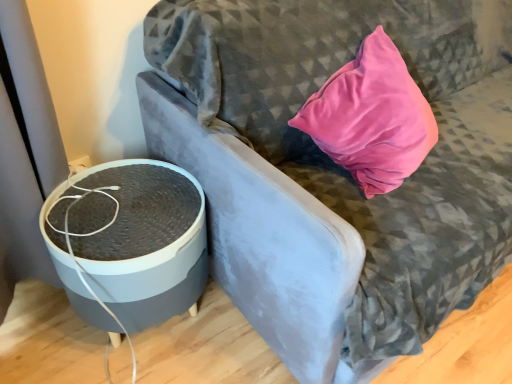
This screenshot has width=512, height=384. Describe the element at coordinates (146, 244) in the screenshot. I see `matte gray round table at left` at that location.

Identify the location of matte gray round table at left. (146, 244).

This screenshot has height=384, width=512. Describe the element at coordinates (341, 167) in the screenshot. I see `matte gray speaker at left` at that location.

Measure the distance between matte gray speaker at left and camera.

matte gray speaker at left and camera are 29.60 inches apart.

Identify the location of matte gray speaker at left. (341, 167).

Locate an element on the screen. This screenshot has width=512, height=384. matte gray round table at left is located at coordinates click(146, 244).

Is matte gray speaker at left to the right of matte gray round table at left from the viewer's perspective?

Yes.

Does matte gray speaker at left lie in front of matte gray round table at left?

Yes, it is.

Which is closer to the camera, (251, 87) or (154, 174)?

Point (251, 87) is positioned closer to the camera compared to point (154, 174).

From the image's perspective, which is below, matte gray speaker at left or matte gray round table at left?

matte gray round table at left, from the image's perspective.

From a real-world perspective, is matte gray speaker at left positioned over matte gray round table at left based on gravity?

Yes.

Is matte gray speaker at left wider than matte gray round table at left?

Yes.

Considering the relative sizes of matte gray speaker at left and matte gray round table at left in the image provided, is matte gray speaker at left taller than matte gray round table at left?

Correct, matte gray speaker at left is much taller as matte gray round table at left.

Who is smaller, matte gray speaker at left or matte gray round table at left?

matte gray round table at left.

Is matte gray speaker at left situated inside matte gray round table at left or outside?

matte gray speaker at left exists outside the volume of matte gray round table at left.

Is matte gray speaker at left placed right next to matte gray round table at left?

matte gray speaker at left and matte gray round table at left are clearly separated.

Is matte gray speaker at left turned away from matte gray round table at left?

matte gray speaker at left is not turned away from matte gray round table at left.

How many degrees apart are the facing directions of matte gray speaker at left and matte gray round table at left?

The angular difference between matte gray speaker at left and matte gray round table at left is 0.747 degrees.

How much distance is there between matte gray speaker at left and matte gray round table at left?

A distance of 14.70 inches exists between matte gray speaker at left and matte gray round table at left.

Where is `furniture above the matte gray round table at left (from the image's perspective)`? furniture above the matte gray round table at left (from the image's perspective) is located at coordinates (341, 167).

Does matte gray round table at left appear on the left side of matte gray speaker at left?

Yes, matte gray round table at left is to the left of matte gray speaker at left.

In the image, is matte gray round table at left positioned in front of or behind matte gray speaker at left?

matte gray round table at left is behind matte gray speaker at left.

Is point (135, 240) closer to viewer compared to point (332, 344)?

No.

Based on the photo, from the image's perspective, is matte gray round table at left on top of matte gray speaker at left?

Actually, matte gray round table at left appears below matte gray speaker at left in the image.

From a real-world perspective, is matte gray round table at left positioned above or below matte gray speaker at left?

matte gray round table at left is below matte gray speaker at left.

Can you confirm if matte gray round table at left is wider than matte gray speaker at left?

In fact, matte gray round table at left might be narrower than matte gray speaker at left.

Considering the relative sizes of matte gray round table at left and matte gray speaker at left in the image provided, is matte gray round table at left taller than matte gray speaker at left?

In fact, matte gray round table at left may be shorter than matte gray speaker at left.

Does matte gray round table at left have a larger size compared to matte gray speaker at left?

No.

Do you think matte gray round table at left is within matte gray speaker at left, or outside of it?

matte gray round table at left is not inside matte gray speaker at left, it's outside.

Is matte gray round table at left not near matte gray speaker at left?

No, matte gray round table at left is not far from matte gray speaker at left.

Is matte gray round table at left positioned with its back to matte gray speaker at left?

No.

How many degrees apart are the facing directions of matte gray round table at left and matte gray speaker at left?

0.747 degrees separate the facing orientations of matte gray round table at left and matte gray speaker at left.

Measure the distance from matte gray round table at left to matte gray speaker at left.

matte gray round table at left and matte gray speaker at left are 37.33 centimeters apart.

Locate an element on the screen. furniture on the right of matte gray round table at left is located at coordinates (341, 167).

Image resolution: width=512 pixels, height=384 pixels. What are the coordinates of `round table lying below the matte gray speaker at left (from the image's perspective)` in the screenshot? It's located at (146, 244).

Find the location of a particular element. This screenshot has height=384, width=512. furniture above the matte gray round table at left (from a real-world perspective) is located at coordinates (341, 167).